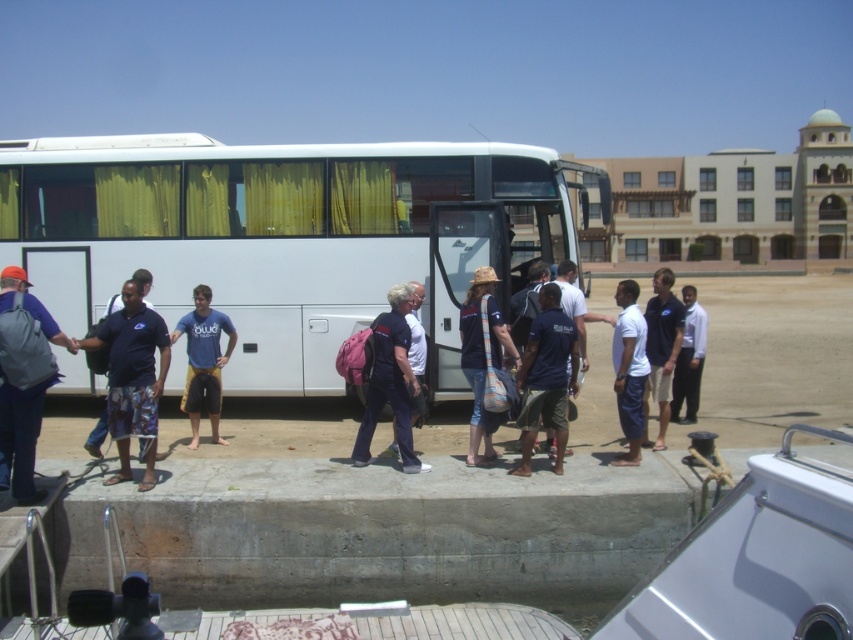
You are a photographer trying to capture a group photo of the dark blue uniform at center and the blue fabric shirt at center. To ensure both are in frame, should you position yourself to the left or right of the group?

Since the dark blue uniform at center is to the left of the blue fabric shirt at center, you should position yourself to the right of the group to ensure both are in frame.